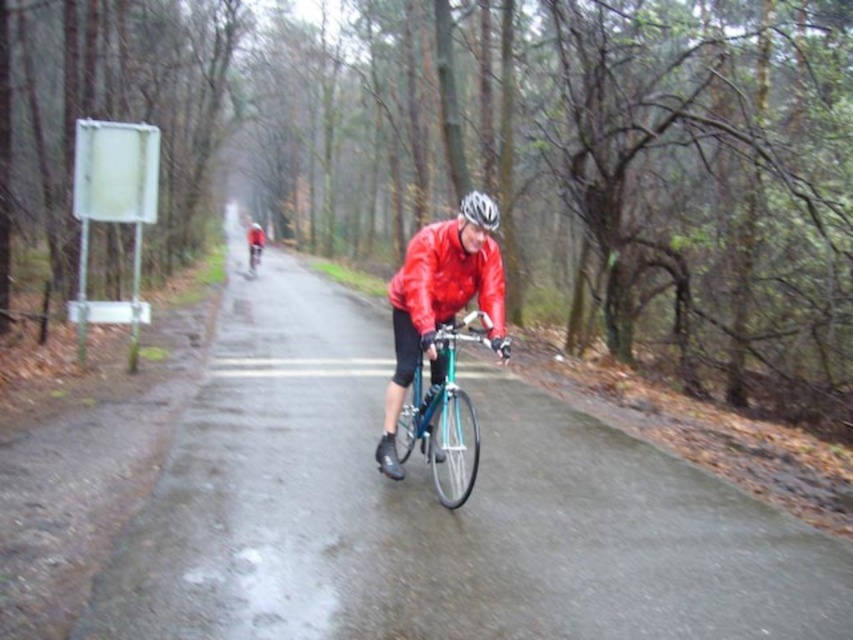
Is matte red jacket at center below white matte helmet at center?

Correct, matte red jacket at center is located below white matte helmet at center.

Does matte red jacket at center come behind white matte helmet at center?

That is True.

Is point (457, 260) more distant than point (488, 208)?

Yes, point (457, 260) is behind point (488, 208).

Identify the location of matte red jacket at center. The height and width of the screenshot is (640, 853). (447, 278).

Describe the element at coordinates (254, 243) in the screenshot. I see `red matte jacket at center` at that location.

Is red matte jacket at center taller than shiny metallic bicycle at center?

Yes.

Locate an element on the screen. red matte jacket at center is located at coordinates (254, 243).

Does white matte helmet at center have a larger size compared to shiny metallic bicycle at center?

Incorrect, white matte helmet at center is not larger than shiny metallic bicycle at center.

Does white matte helmet at center have a lesser width compared to shiny metallic bicycle at center?

Yes, white matte helmet at center is thinner than shiny metallic bicycle at center.

Where is `white matte helmet at center`? The image size is (853, 640). white matte helmet at center is located at coordinates (479, 211).